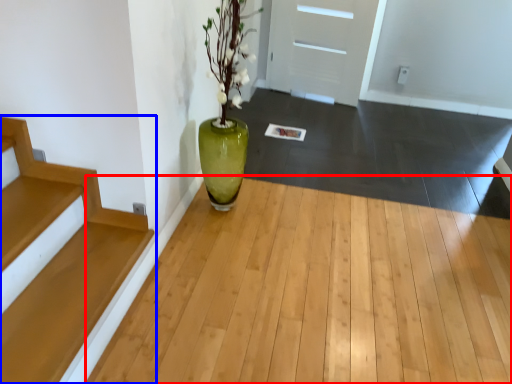
Question: Which of the following is the closest to the observer, corridor (highlighted by a red box) or stairs (highlighted by a blue box)?

Choices:
 (A) corridor
 (B) stairs

Answer: (A)